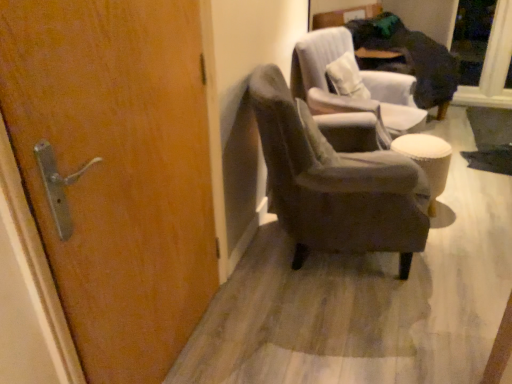
Question: Is wooden door at left wider or thinner than transparent glass door at upper right?

Choices:
 (A) wide
 (B) thin

Answer: (A)

Question: From a real-world perspective, relative to transparent glass door at upper right, is wooden door at left vertically above or below?

Choices:
 (A) below
 (B) above

Answer: (B)

Question: Considering the real-world distances, which object is farthest from the velvet gray armchair at center, which appears as the 2th chair when viewed from the front?

Choices:
 (A) wooden door at left
 (B) transparent glass door at upper right
 (C) velvet gray armchair at center, placed as the 1th chair when sorted from front to back
 (D) white fabric stool at right

Answer: (B)

Question: Which object is positioned farthest from the velvet gray armchair at center, which appears as the 2th chair when viewed from the front?

Choices:
 (A) transparent glass door at upper right
 (B) white fabric stool at right
 (C) velvet gray armchair at center, placed as the 2th chair when sorted from back to front
 (D) wooden door at left

Answer: (A)